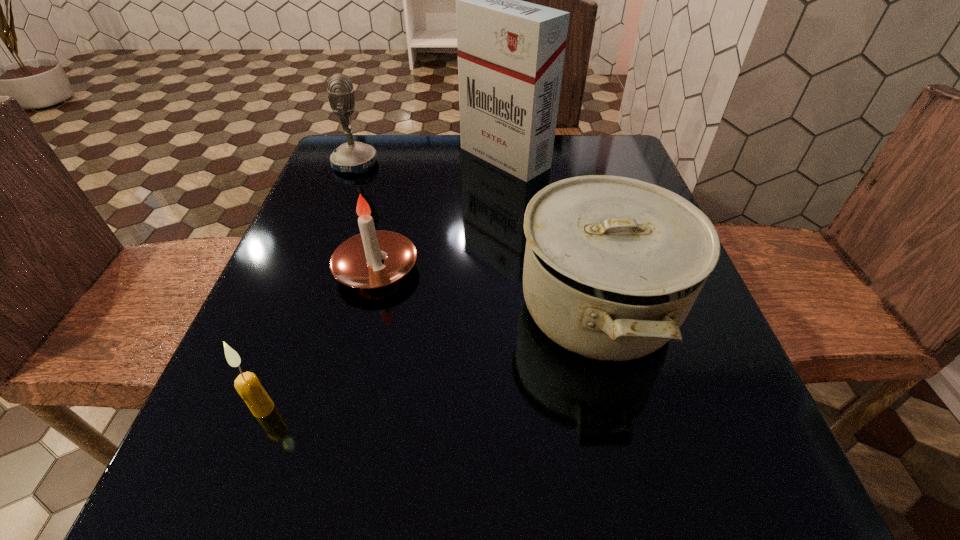
Where is `cigarette case that is positioned at the far edge`? The width and height of the screenshot is (960, 540). cigarette case that is positioned at the far edge is located at coordinates (511, 53).

Locate an element on the screen. microphone that is at the far edge is located at coordinates 354,157.

Where is `microphone positioned at the left edge`? The image size is (960, 540). microphone positioned at the left edge is located at coordinates (354, 157).

Identify the location of object at the right edge. (613, 265).

Where is `object located at the far left corner`? This screenshot has height=540, width=960. object located at the far left corner is located at coordinates (354, 157).

Find the location of a particular element. This screenshot has width=960, height=540. vacant space at the near edge of the desktop is located at coordinates (572, 474).

In order to click on free space at the left edge of the desktop in this screenshot , I will do `click(280, 257)`.

Identify the location of free space at the right edge of the desktop. The height and width of the screenshot is (540, 960). (650, 389).

The image size is (960, 540). What are the coordinates of `free region at the far left corner of the desktop` in the screenshot? It's located at (353, 179).

At what (x,y) coordinates should I click in order to perform the action: click on blank space at the near left corner of the desktop. Please return your answer as a coordinate pair (x, y). This screenshot has height=540, width=960. Looking at the image, I should click on (227, 501).